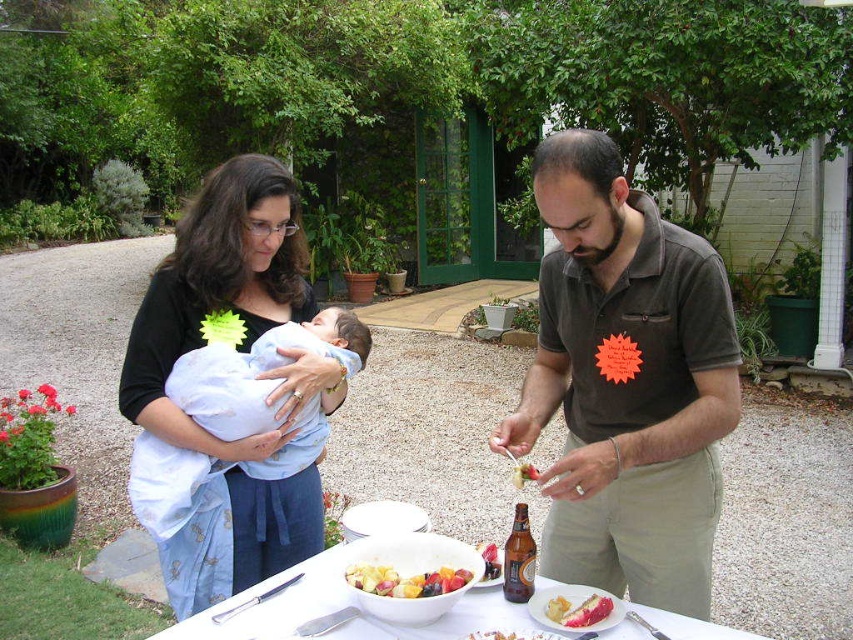
You are a guest at this outdoor gathering and want to grab both the white ceramic bowl at center and the smooth white cake at center. How far apart are these two items on the table?

The white ceramic bowl at center is 16.68 inches away from the smooth white cake at center.

You are a waiter at a garden party and need to place a 16 inch long platter between the brown cotton shirt at center and the brown glass bottle at center. Can you fit it there?

The distance between the brown cotton shirt at center and the brown glass bottle at center is 17.21 inches. Since the platter is 16 inches long, it can fit in the space between them.

You are planning to serve more guests and need to know which item on the table has more space around it. Which one is bigger between the white ceramic bowl at center and the smooth white cake at center?

The white ceramic bowl at center is larger in size than the smooth white cake at center, so it has more space around it.